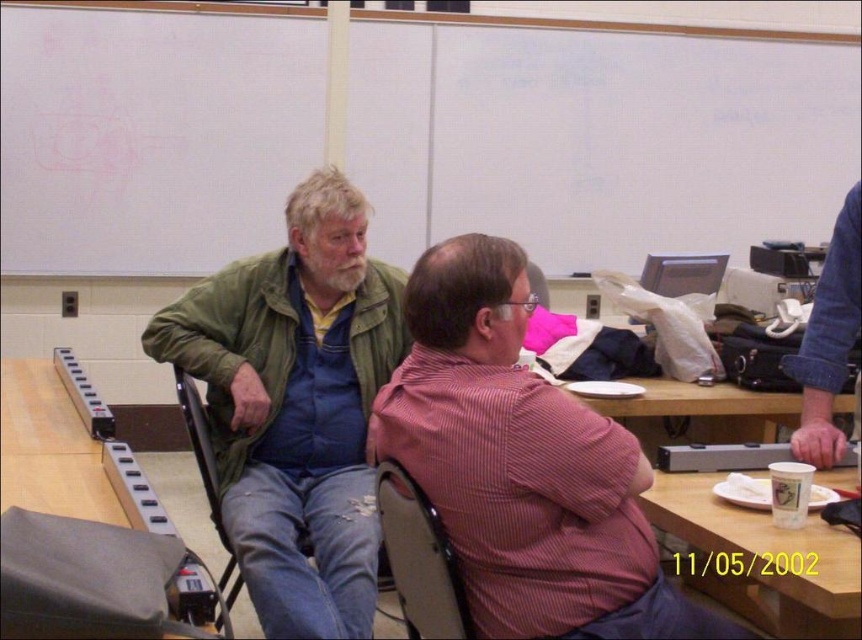
Question: Which point appears farthest from the camera in this image?

Choices:
 (A) (223, 570)
 (B) (528, 268)
 (C) (441, 580)
 (D) (817, 557)

Answer: (B)

Question: Can you confirm if wooden table at center is positioned to the right of green fabric chair at left?

Choices:
 (A) no
 (B) yes

Answer: (B)

Question: Which point appears farthest from the camera in this image?

Choices:
 (A) (182, 406)
 (B) (694, 483)
 (C) (395, 541)

Answer: (A)

Question: Considering the relative positions of white matte board at upper center and wooden table at center in the image provided, where is white matte board at upper center located with respect to wooden table at center?

Choices:
 (A) right
 (B) left

Answer: (B)

Question: Which of the following is the farthest from the observer?

Choices:
 (A) [815, 566]
 (B) [216, 476]

Answer: (B)

Question: Is white matte board at upper center smaller than matte plastic chair at center?

Choices:
 (A) no
 (B) yes

Answer: (A)